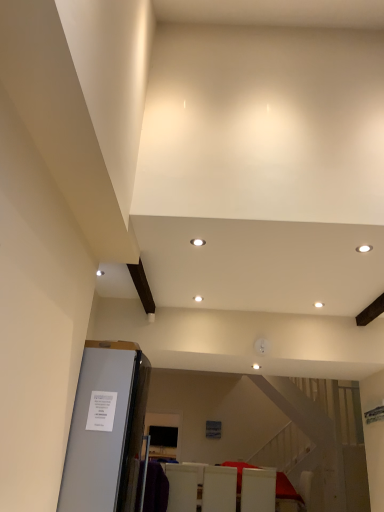
Question: Is white matte chair at lower center, the 3th furniture in the right-to-left sequence, facing towards satin silver refrigerator at lower left?

Choices:
 (A) no
 (B) yes

Answer: (A)

Question: Is white matte chair at lower center, which appears as the first furniture when viewed from the left, smaller than satin silver refrigerator at lower left?

Choices:
 (A) yes
 (B) no

Answer: (A)

Question: From a real-world perspective, is white matte chair at lower center, which appears as the first furniture when viewed from the left, over satin silver refrigerator at lower left?

Choices:
 (A) yes
 (B) no

Answer: (B)

Question: From the image's perspective, would you say white matte chair at lower center, the 3th furniture in the right-to-left sequence, is shown under satin silver refrigerator at lower left?

Choices:
 (A) no
 (B) yes

Answer: (B)

Question: Does white matte chair at lower center, which appears as the first furniture when viewed from the left, appear on the right side of satin silver refrigerator at lower left?

Choices:
 (A) yes
 (B) no

Answer: (A)

Question: Is white matte chair at lower center, which appears as the first furniture when viewed from the left, facing away from satin silver refrigerator at lower left?

Choices:
 (A) yes
 (B) no

Answer: (A)

Question: Is white glossy chair at lower center, the first furniture positioned from the right, taller than white matte chair at lower center, the 3th furniture in the right-to-left sequence?

Choices:
 (A) yes
 (B) no

Answer: (B)

Question: Would you say white glossy chair at lower center, acting as the third furniture starting from the left, contains white matte chair at lower center, which appears as the first furniture when viewed from the left?

Choices:
 (A) no
 (B) yes

Answer: (A)

Question: From the image's perspective, would you say white glossy chair at lower center, the first furniture positioned from the right, is positioned over white matte chair at lower center, which appears as the first furniture when viewed from the left?

Choices:
 (A) yes
 (B) no

Answer: (B)

Question: Considering the relative sizes of white glossy chair at lower center, acting as the third furniture starting from the left, and white matte chair at lower center, which appears as the first furniture when viewed from the left, in the image provided, is white glossy chair at lower center, acting as the third furniture starting from the left, thinner than white matte chair at lower center, which appears as the first furniture when viewed from the left,?

Choices:
 (A) no
 (B) yes

Answer: (B)

Question: Does white glossy chair at lower center, the first furniture positioned from the right, have a larger size compared to white matte chair at lower center, the 3th furniture in the right-to-left sequence?

Choices:
 (A) no
 (B) yes

Answer: (A)

Question: Considering the relative sizes of white glossy chair at lower center, acting as the third furniture starting from the left, and white matte chair at lower center, the 3th furniture in the right-to-left sequence, in the image provided, is white glossy chair at lower center, acting as the third furniture starting from the left, shorter than white matte chair at lower center, the 3th furniture in the right-to-left sequence,?

Choices:
 (A) yes
 (B) no

Answer: (A)

Question: From a real-world perspective, is satin silver refrigerator at lower left under white glossy chair at lower center, the first furniture positioned from the right?

Choices:
 (A) no
 (B) yes

Answer: (A)